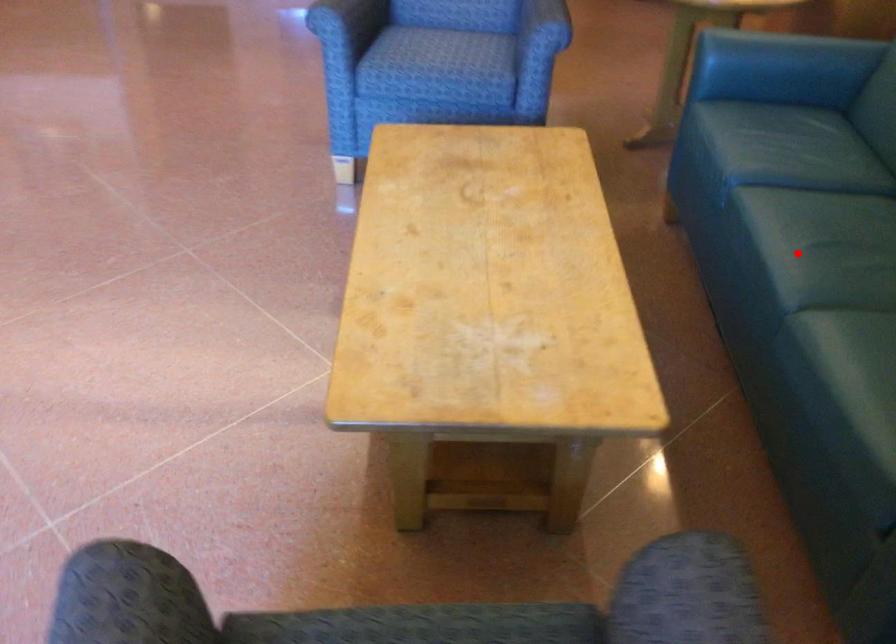
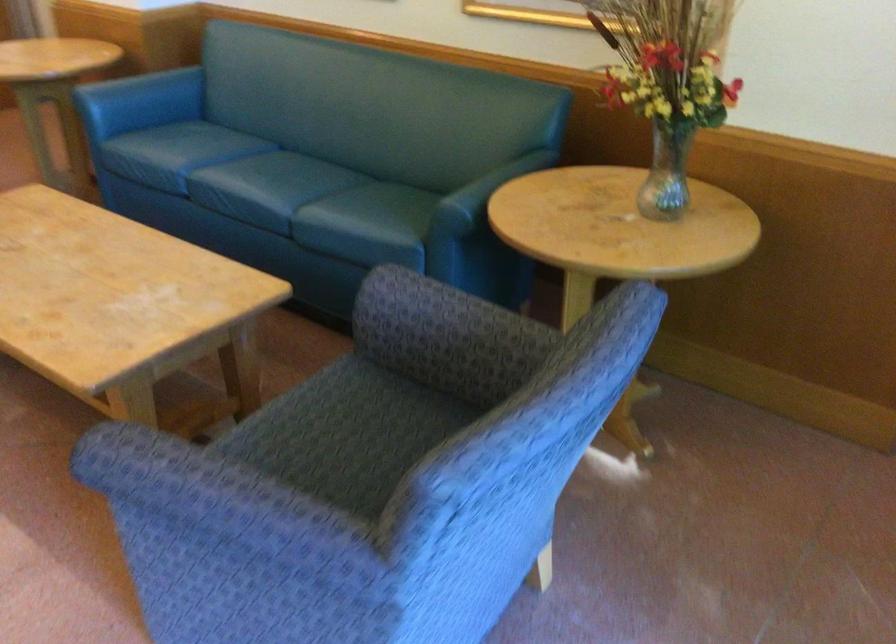
The point at the highlighted location is marked in the first image. Where is the corresponding point in the second image?

(269, 187)